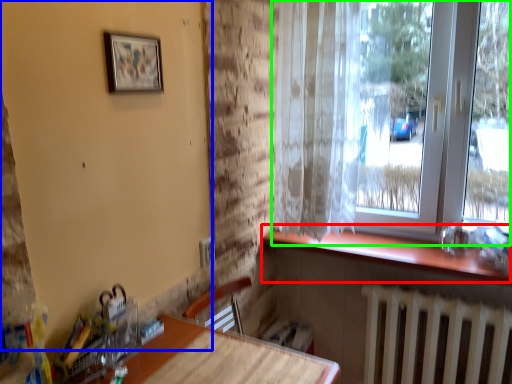
Question: Based on their relative distances, which object is farther from window sill (highlighted by a red box)? Choose from backdrop (highlighted by a blue box) and window (highlighted by a green box).

Choices:
 (A) backdrop
 (B) window

Answer: (A)